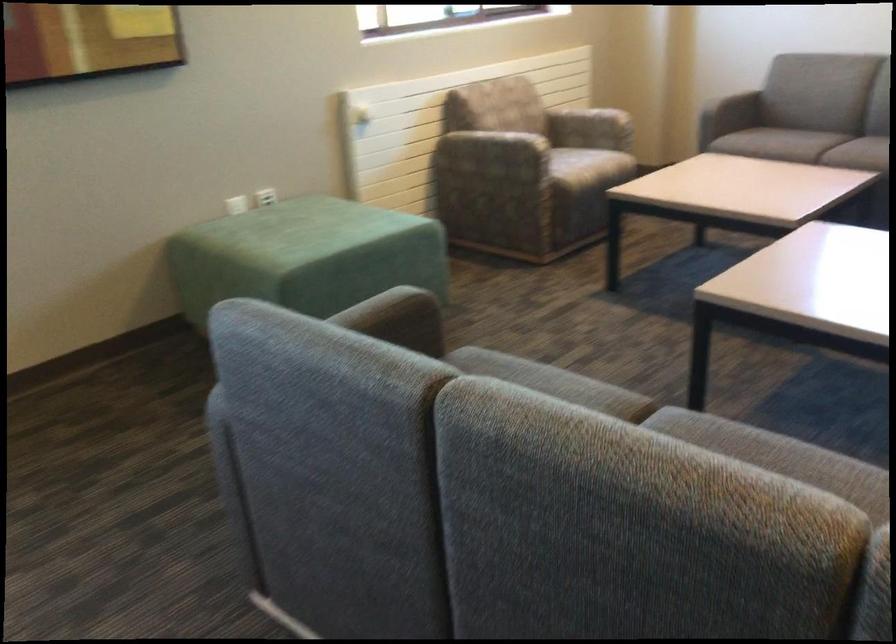
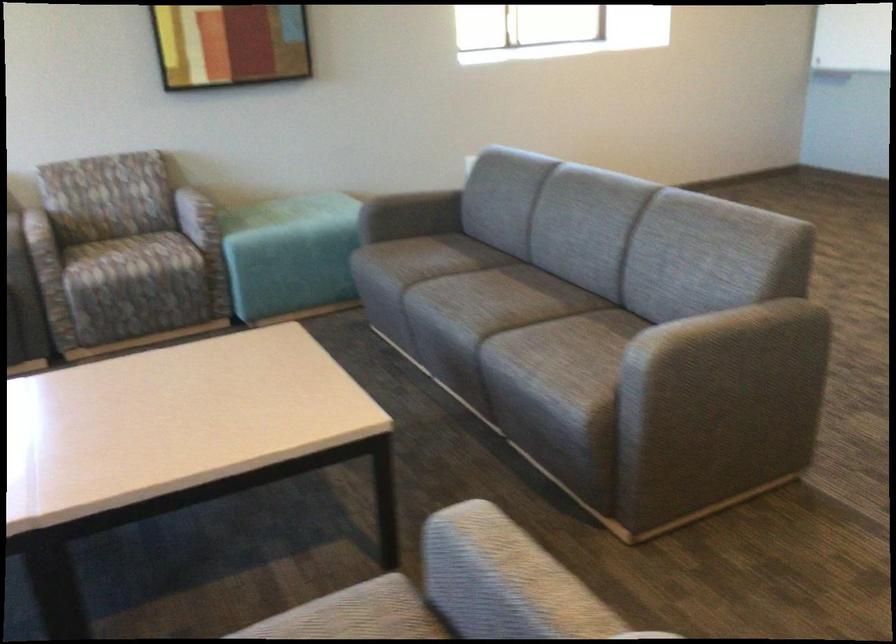
Question: The images are taken continuously from a first-person perspective. In which direction is your viewpoint rotating?

Choices:
 (A) Left
 (B) Right
 (C) Up
 (D) Down

Answer: (B)